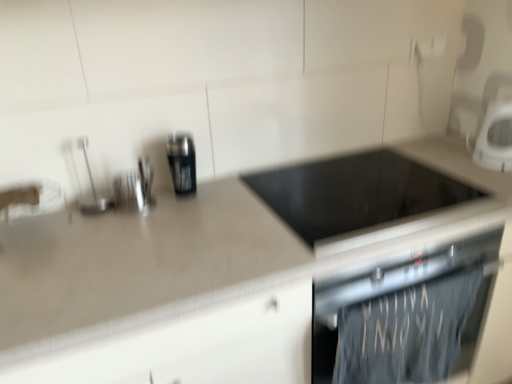
The width and height of the screenshot is (512, 384). What do you see at coordinates (495, 138) in the screenshot?
I see `white glossy microwave at upper right, placed as the second kitchen appliance when sorted from left to right` at bounding box center [495, 138].

This screenshot has height=384, width=512. I want to click on white glossy microwave at upper right, placed as the second kitchen appliance when sorted from left to right, so click(x=495, y=138).

Where is `metallic can at center, the 2th kitchen appliance from the right`? The image size is (512, 384). metallic can at center, the 2th kitchen appliance from the right is located at coordinates (182, 163).

You are a GUI agent. You are given a task and a screenshot of the screen. Output one action in this format:
    pyautogui.click(x=<x>, y=<y>)
    Task: Click on the dark gray fabric towel at lower right
    
    Given the screenshot: What is the action you would take?
    pyautogui.click(x=407, y=317)

What do you see at coordinates (177, 277) in the screenshot? The height and width of the screenshot is (384, 512). I see `beige laminate countertop at center` at bounding box center [177, 277].

Where is `white glossy microwave at upper right, placed as the second kitchen appliance when sorted from left to right`? white glossy microwave at upper right, placed as the second kitchen appliance when sorted from left to right is located at coordinates (495, 138).

From a real-world perspective, which object stands above the other?

brushed metal utensil holder at upper left, which appears as the 2th appliance when viewed from the left.

Is brushed metal utensil holder at upper left, the 2th appliance viewed from the right, spatially inside beige laminate countertop at center, or outside of it?

brushed metal utensil holder at upper left, the 2th appliance viewed from the right, exists outside the volume of beige laminate countertop at center.

Who is shorter, brushed metal utensil holder at upper left, which appears as the 2th appliance when viewed from the left, or beige laminate countertop at center?

With less height is brushed metal utensil holder at upper left, which appears as the 2th appliance when viewed from the left.

Does brushed metal utensil holder at upper left, the 2th appliance viewed from the right, appear on the left side of dark gray fabric towel at lower right?

Yes.

Is brushed metal utensil holder at upper left, the 2th appliance viewed from the right, bigger or smaller than dark gray fabric towel at lower right?

brushed metal utensil holder at upper left, the 2th appliance viewed from the right, is smaller than dark gray fabric towel at lower right.

Is brushed metal utensil holder at upper left, the 2th appliance viewed from the right, inside or outside of dark gray fabric towel at lower right?

brushed metal utensil holder at upper left, the 2th appliance viewed from the right, lies outside dark gray fabric towel at lower right.

Is dark gray fabric towel at lower right oriented towards brushed metal utensil holder at upper left, the 2th appliance viewed from the right?

No.

Considering the relative sizes of dark gray fabric towel at lower right and brushed metal utensil holder at upper left, which appears as the 2th appliance when viewed from the left, in the image provided, is dark gray fabric towel at lower right shorter than brushed metal utensil holder at upper left, which appears as the 2th appliance when viewed from the left,?

No.

Who is bigger, dark gray fabric towel at lower right or brushed metal utensil holder at upper left, the 2th appliance viewed from the right?

With larger size is dark gray fabric towel at lower right.

Which is more to the right, metallic can at center, arranged as the 1th kitchen appliance when viewed from the left, or dark gray fabric towel at lower right?

Positioned to the right is dark gray fabric towel at lower right.

Which object is thinner, metallic can at center, arranged as the 1th kitchen appliance when viewed from the left, or dark gray fabric towel at lower right?

dark gray fabric towel at lower right.

Identify the location of appliance that is the 2nd object located behind the beige laminate countertop at center. (91, 187).

Consider the image. Considering the sizes of objects beige laminate countertop at center and brushed metal spoon at upper left, which is the first appliance from left to right, in the image provided, who is shorter, beige laminate countertop at center or brushed metal spoon at upper left, which is the first appliance from left to right,?

brushed metal spoon at upper left, which is the first appliance from left to right, is shorter.

Is point (195, 318) more distant than point (94, 211)?

That is False.

Is white glossy microwave at upper right, placed as the second kitchen appliance when sorted from left to right, inside or outside of black glass cooktop at center, positioned as the third appliance in left-to-right order?

white glossy microwave at upper right, placed as the second kitchen appliance when sorted from left to right, is not inside black glass cooktop at center, positioned as the third appliance in left-to-right order, it's outside.

Looking at this image, from a real-world perspective, who is located higher, white glossy microwave at upper right, placed as the second kitchen appliance when sorted from left to right, or black glass cooktop at center, positioned as the third appliance in left-to-right order?

From a 3D spatial view, white glossy microwave at upper right, placed as the second kitchen appliance when sorted from left to right, is above.

From a real-world perspective, count 2nd appliances downward from the white glossy microwave at upper right, which is the 1th kitchen appliance from right to left, and point to it. Please provide its 2D coordinates.

[(357, 196)]

How many degrees apart are the facing directions of white glossy microwave at upper right, placed as the second kitchen appliance when sorted from left to right, and black glass cooktop at center, positioned as the third appliance in left-to-right order?

The angular difference between white glossy microwave at upper right, placed as the second kitchen appliance when sorted from left to right, and black glass cooktop at center, positioned as the third appliance in left-to-right order, is 1.4 degrees.

Is beige laminate countertop at center positioned before brushed metal utensil holder at upper left, the 2th appliance viewed from the right?

Yes, the depth of beige laminate countertop at center is less than that of brushed metal utensil holder at upper left, the 2th appliance viewed from the right.

Is beige laminate countertop at center situated inside brushed metal utensil holder at upper left, which appears as the 2th appliance when viewed from the left, or outside?

beige laminate countertop at center lies outside brushed metal utensil holder at upper left, which appears as the 2th appliance when viewed from the left.

Which is further, (x=94, y=336) or (x=133, y=179)?

The point (x=133, y=179) is more distant.

From a real-world perspective, which is physically above, beige laminate countertop at center or brushed metal utensil holder at upper left, which appears as the 2th appliance when viewed from the left?

Answer: In real-world perspective, brushed metal utensil holder at upper left, which appears as the 2th appliance when viewed from the left, is above.

Locate an element on the screen. appliance that is the 3rd one when counting backward from the beige laminate countertop at center is located at coordinates (134, 187).

Where is `home appliance on the right of brushed metal utensil holder at upper left, the 2th appliance viewed from the right`? This screenshot has width=512, height=384. home appliance on the right of brushed metal utensil holder at upper left, the 2th appliance viewed from the right is located at coordinates (407, 317).

Which object lies nearer to the anchor point brushed metal spoon at upper left, which is the first appliance from left to right, metallic can at center, the 2th kitchen appliance from the right, or beige laminate countertop at center?

Based on the image, metallic can at center, the 2th kitchen appliance from the right, appears to be nearer to brushed metal spoon at upper left, which is the first appliance from left to right.

In the scene shown: When comparing their distances from black glass cooktop at center, positioned as the third appliance in left-to-right order, does brushed metal utensil holder at upper left, the 2th appliance viewed from the right, or dark gray fabric towel at lower right seem further?

The object further to black glass cooktop at center, positioned as the third appliance in left-to-right order, is brushed metal utensil holder at upper left, the 2th appliance viewed from the right.

When comparing their distances from white glossy microwave at upper right, which is the 1th kitchen appliance from right to left, does metallic can at center, the 2th kitchen appliance from the right, or brushed metal utensil holder at upper left, the 2th appliance viewed from the right, seem further?

brushed metal utensil holder at upper left, the 2th appliance viewed from the right, is positioned further to the anchor white glossy microwave at upper right, which is the 1th kitchen appliance from right to left.

Which object lies nearer to the anchor point dark gray fabric towel at lower right, brushed metal utensil holder at upper left, the 2th appliance viewed from the right, or metallic can at center, the 2th kitchen appliance from the right?

metallic can at center, the 2th kitchen appliance from the right, is positioned closer to the anchor dark gray fabric towel at lower right.

Which object lies further to the anchor point brushed metal utensil holder at upper left, which appears as the 2th appliance when viewed from the left, black glass cooktop at center, positioned as the third appliance in left-to-right order, or metallic can at center, the 2th kitchen appliance from the right?

black glass cooktop at center, positioned as the third appliance in left-to-right order, lies further to brushed metal utensil holder at upper left, which appears as the 2th appliance when viewed from the left, than the other object.

Based on the photo, looking at the image, which one is located closer to black glass cooktop at center, positioned as the third appliance in left-to-right order, brushed metal spoon at upper left, which is the first appliance from left to right, or dark gray fabric towel at lower right?

dark gray fabric towel at lower right is closer to black glass cooktop at center, positioned as the third appliance in left-to-right order.

Estimate the real-world distances between objects in this image. Which object is further from dark gray fabric towel at lower right, beige laminate countertop at center or black glass cooktop at center, positioned as the third appliance in left-to-right order?

Based on the image, black glass cooktop at center, positioned as the third appliance in left-to-right order, appears to be further to dark gray fabric towel at lower right.

From the image, which object appears to be nearer to brushed metal spoon at upper left, which is the first appliance from left to right, beige laminate countertop at center or metallic can at center, arranged as the 1th kitchen appliance when viewed from the left?

Based on the image, metallic can at center, arranged as the 1th kitchen appliance when viewed from the left, appears to be nearer to brushed metal spoon at upper left, which is the first appliance from left to right.

Where is `home appliance situated between brushed metal utensil holder at upper left, which appears as the 2th appliance when viewed from the left, and white glossy microwave at upper right, placed as the second kitchen appliance when sorted from left to right, from left to right`? This screenshot has width=512, height=384. home appliance situated between brushed metal utensil holder at upper left, which appears as the 2th appliance when viewed from the left, and white glossy microwave at upper right, placed as the second kitchen appliance when sorted from left to right, from left to right is located at coordinates (407, 317).

Where is `countertop between brushed metal utensil holder at upper left, which appears as the 2th appliance when viewed from the left, and white glossy microwave at upper right, placed as the second kitchen appliance when sorted from left to right, in the horizontal direction`? countertop between brushed metal utensil holder at upper left, which appears as the 2th appliance when viewed from the left, and white glossy microwave at upper right, placed as the second kitchen appliance when sorted from left to right, in the horizontal direction is located at coordinates (177, 277).

At what (x,y) coordinates should I click in order to perform the action: click on appliance between metallic can at center, the 2th kitchen appliance from the right, and dark gray fabric towel at lower right. Please return your answer as a coordinate pair (x, y). Looking at the image, I should click on (357, 196).

Find the location of a particular element. The width and height of the screenshot is (512, 384). kitchen appliance between brushed metal spoon at upper left, which is the first appliance from left to right, and white glossy microwave at upper right, placed as the second kitchen appliance when sorted from left to right is located at coordinates (182, 163).